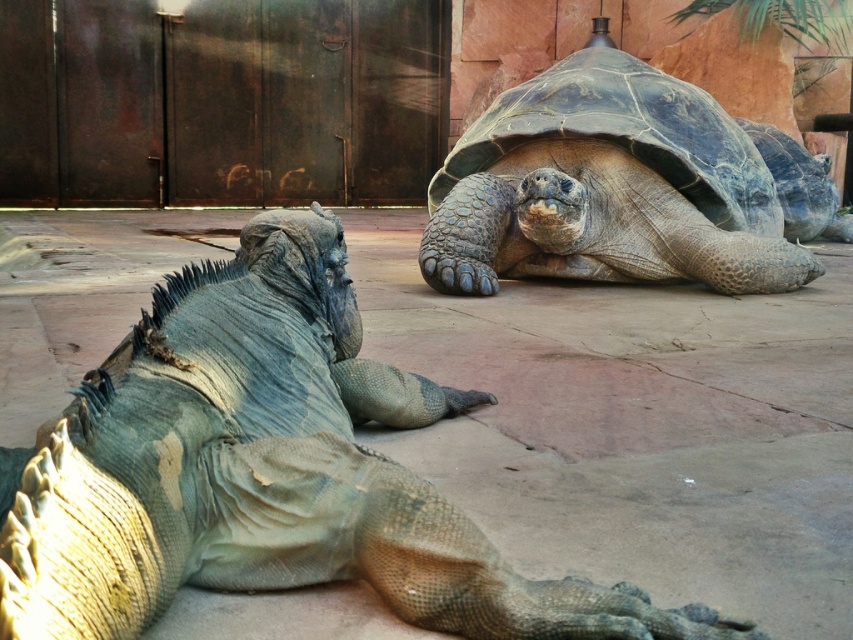
You are a zookeeper observing the enclosure. You need to place a feeding dish between the scaly gray iguana at center and the dark gray textured tortoise at center. Which animal will the dish be closer to after placement?

The feeding dish will be closer to the scaly gray iguana at center because it is positioned closer to the viewer than the dark gray textured tortoise at center.

You are a zookeeper observing the enclosure. You need to determine which animal is taller between the scaly gray iguana at center and the shiny dark green tortoise at upper right. Which one is taller?

The shiny dark green tortoise at upper right is taller than the scaly gray iguana at center.